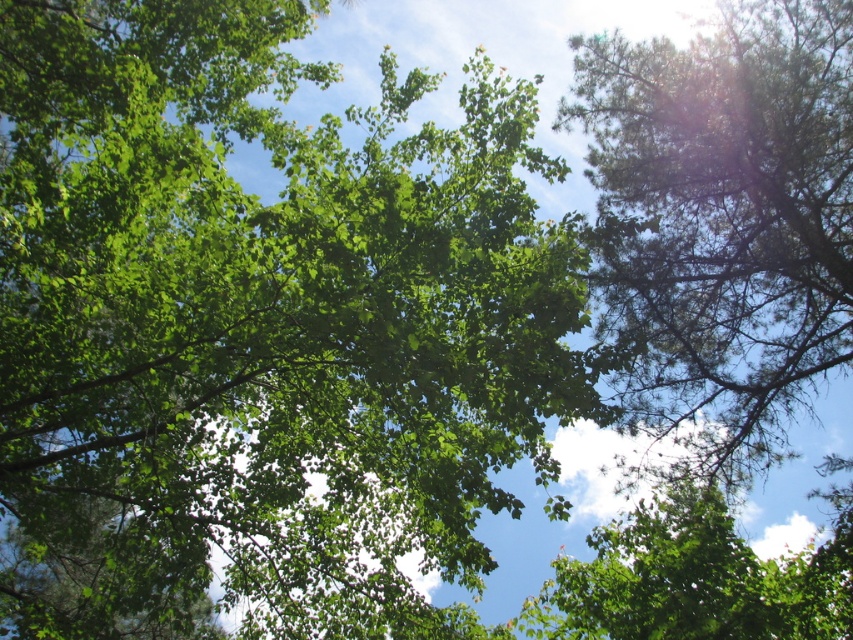
Question: Which point is closer to the camera?

Choices:
 (A) (688, 518)
 (B) (630, 124)
 (C) (395, 397)

Answer: (C)

Question: Which point is closer to the camera?

Choices:
 (A) click(x=106, y=630)
 (B) click(x=776, y=579)

Answer: (A)

Question: Which of the following is the closest to the observer?

Choices:
 (A) (807, 598)
 (B) (317, 500)
 (C) (701, 208)

Answer: (A)

Question: Is green needle-like at right wider than green leafy tree at upper center?

Choices:
 (A) yes
 (B) no

Answer: (B)

Question: Is the position of green leafy tree at center more distant than that of green leafy tree at upper center?

Choices:
 (A) yes
 (B) no

Answer: (B)

Question: Can you confirm if green leafy tree at center is positioned below green leafy tree at upper center?

Choices:
 (A) yes
 (B) no

Answer: (B)